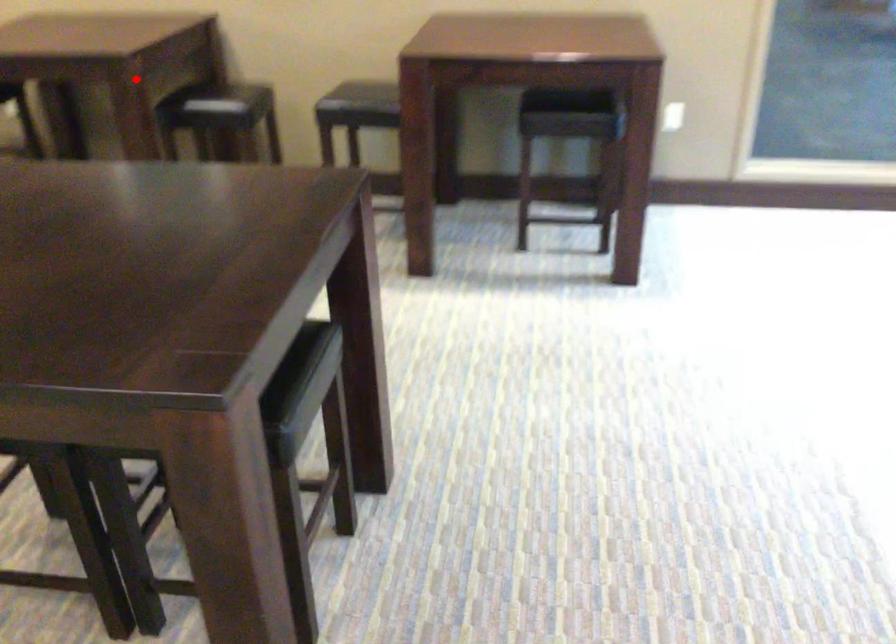
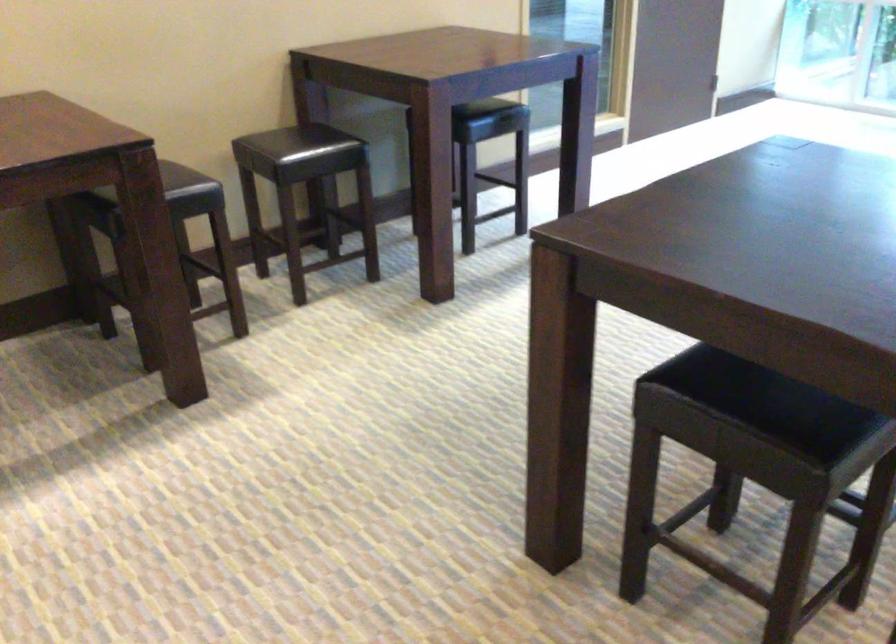
The point at the highlighted location is marked in the first image. Where is the corresponding point in the second image?

(168, 182)